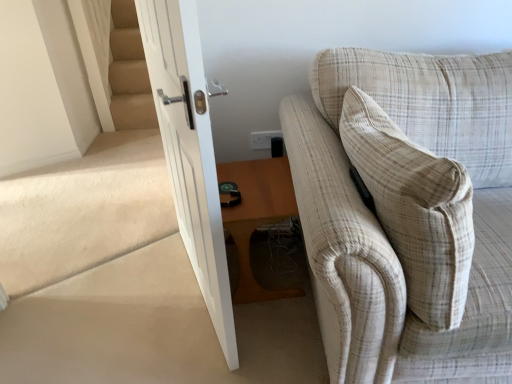
At what (x,y) coordinates should I click in order to perform the action: click on free space between beige carpeted stairs at left and white glossy door at center. Please return your answer as a coordinate pair (x, y). The height and width of the screenshot is (384, 512). Looking at the image, I should click on (136, 302).